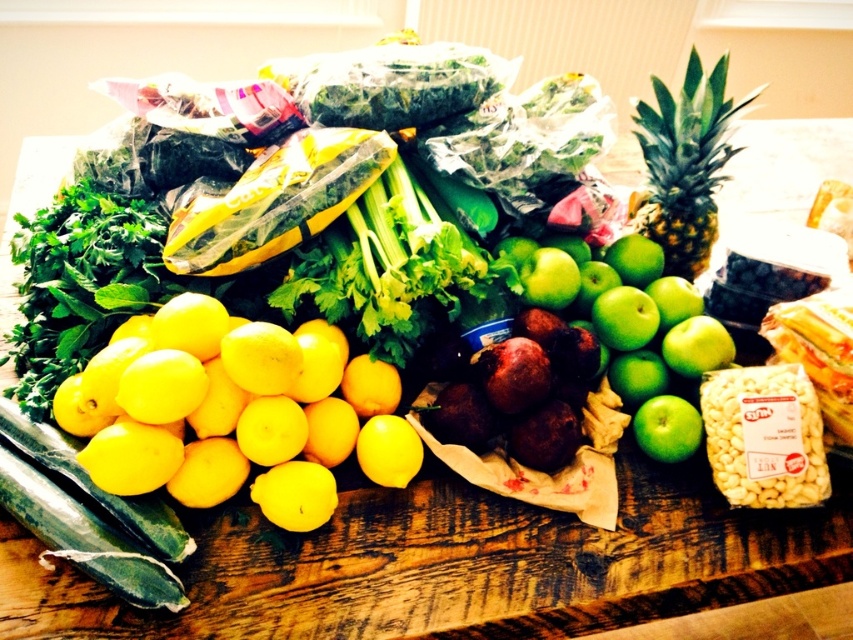
Question: Does green matte pineapple at upper right appear over yellow matte lemon at center?

Choices:
 (A) no
 (B) yes

Answer: (B)

Question: Which object is positioned farthest from the green matte apples at center-right?

Choices:
 (A) yellow matte lemon at center
 (B) yellow matte lemons at left
 (C) green matte pineapple at upper right
 (D) green matte apple at center-right

Answer: (B)

Question: Is green matte pineapple at upper right further to camera compared to green matte apple at center-right?

Choices:
 (A) yes
 (B) no

Answer: (A)

Question: Based on their relative distances, which object is nearer to the green matte apples at center-right?

Choices:
 (A) green matte pineapple at upper right
 (B) yellow matte lemon at center
 (C) green matte apple at center-right

Answer: (C)

Question: Based on their relative distances, which object is nearer to the green matte pineapple at upper right?

Choices:
 (A) green matte apples at center-right
 (B) yellow matte lemons at left
 (C) yellow matte lemon at center
 (D) green matte apple at center-right

Answer: (A)

Question: Is green matte apples at center-right to the right of green matte apple at center-right from the viewer's perspective?

Choices:
 (A) yes
 (B) no

Answer: (B)